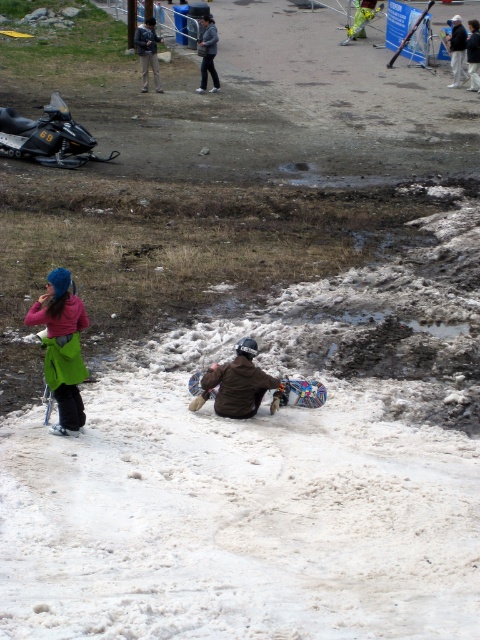
What do you see at coordinates (61, 348) in the screenshot? I see `matte pink jacket at left` at bounding box center [61, 348].

The image size is (480, 640). Identify the location of matte pink jacket at left. (61, 348).

Identify the location of matte pink jacket at left. Image resolution: width=480 pixels, height=640 pixels. (61, 348).

Which is behind, point (59, 161) or point (251, 344)?

Point (59, 161)

Can you confirm if black matte snowmobile at left is bigger than brown suede snowboarder at center?

Yes.

Is point (24, 120) in front of point (228, 369)?

No, it is behind (228, 369).

Where is `black matte snowmobile at left`? black matte snowmobile at left is located at coordinates (48, 136).

Between point (66, 275) and point (144, 29), which one is positioned in front?

Point (66, 275) is more forward.

Is matte pink jacket at left below denim jacket at upper center?

Yes.

What are the coordinates of `matte pink jacket at left` in the screenshot? It's located at (61, 348).